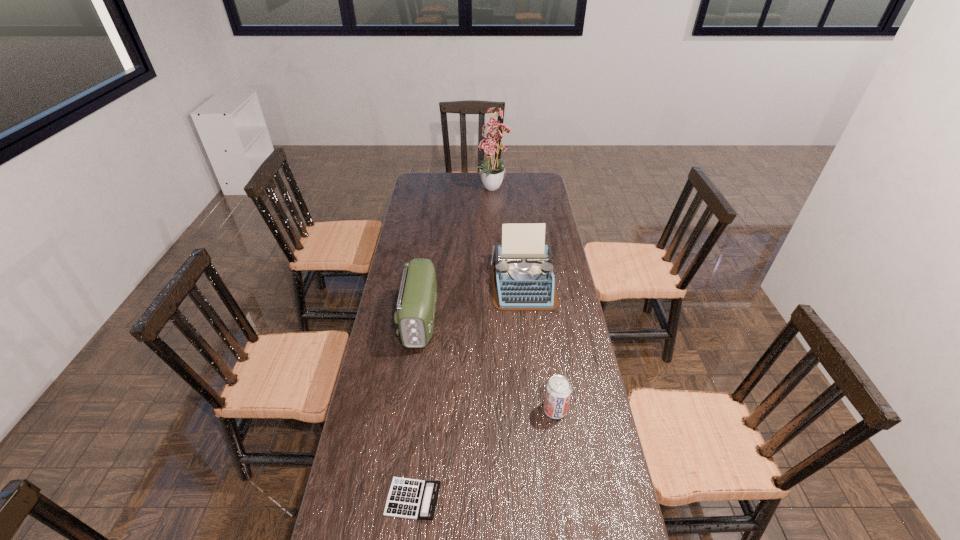
In the image, there is a desktop. Where is `blank space at the right edge`? blank space at the right edge is located at coordinates (563, 363).

You are a GUI agent. You are given a task and a screenshot of the screen. Output one action in this format:
    pyautogui.click(x=<x>, y=<y>)
    Task: Click on the free space at the far left corner
    This screenshot has height=540, width=960.
    Given the screenshot: What is the action you would take?
    pyautogui.click(x=436, y=188)

The width and height of the screenshot is (960, 540). Identify the location of free space that is in between the soda can and the radio_receiver. (488, 364).

The image size is (960, 540). Identify the location of free space between the radio_receiver and the tallest object. [x=457, y=254].

I want to click on vacant point located between the radio_receiver and the tallest object, so click(x=457, y=254).

At what (x,y) coordinates should I click in order to perform the action: click on free spot between the calculator and the typewriter. Please return your answer as a coordinate pair (x, y). Looking at the image, I should click on (468, 392).

This screenshot has width=960, height=540. What are the coordinates of `free space that is in between the radio_receiver and the nearest object` in the screenshot? It's located at (417, 409).

Locate an element on the screen. The height and width of the screenshot is (540, 960). blank region between the calculator and the typewriter is located at coordinates (468, 392).

Select which object appears as the second closest to the typewriter. Please provide its 2D coordinates. Your answer should be formatted as a tuple, i.e. [(x, y)], where the tuple contains the x and y coordinates of a point satisfying the conditions above.

[(558, 390)]

This screenshot has width=960, height=540. I want to click on object that can be found as the second closest to the soda can, so click(522, 275).